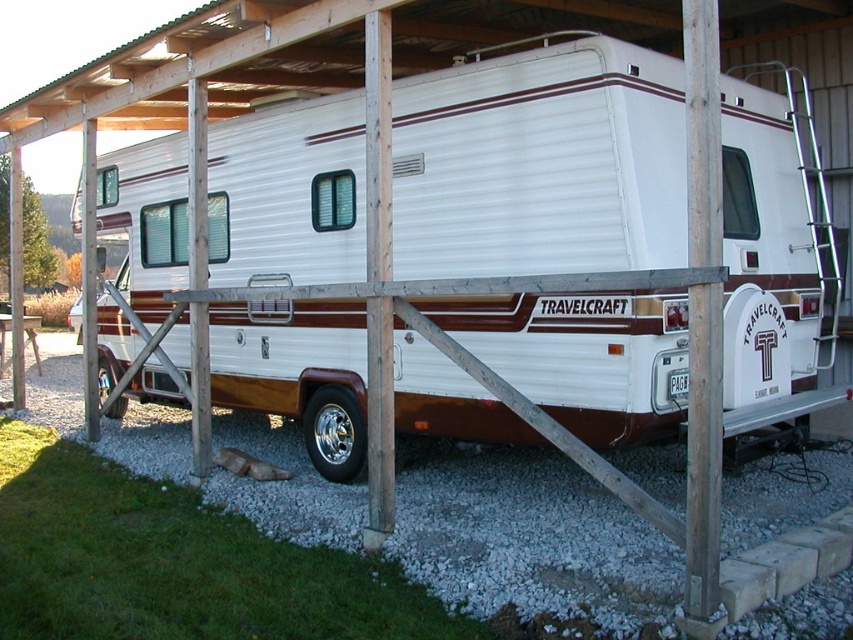
Is white glossy recreational vehicle at center shorter than white gravel at lower center?

No.

Is point (434, 403) positioned in front of point (601, 573)?

No.

This screenshot has width=853, height=640. Describe the element at coordinates (540, 163) in the screenshot. I see `white glossy recreational vehicle at center` at that location.

Identify the location of white glossy recreational vehicle at center. (540, 163).